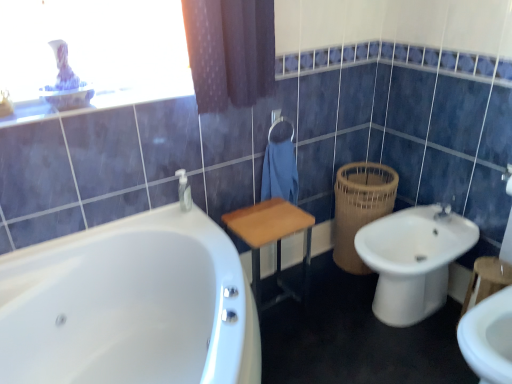
Question: Can you confirm if blue fabric towel at center is shorter than white ceramic bidet at lower right?

Choices:
 (A) yes
 (B) no

Answer: (A)

Question: Is blue fabric towel at center further to camera compared to white ceramic bidet at lower right?

Choices:
 (A) no
 (B) yes

Answer: (B)

Question: Is blue fabric towel at center placed right next to white ceramic bidet at lower right?

Choices:
 (A) yes
 (B) no

Answer: (B)

Question: Can we say blue fabric towel at center lies outside white ceramic bidet at lower right?

Choices:
 (A) no
 (B) yes

Answer: (B)

Question: Considering the relative sizes of blue fabric towel at center and white ceramic bidet at lower right in the image provided, is blue fabric towel at center bigger than white ceramic bidet at lower right?

Choices:
 (A) no
 (B) yes

Answer: (A)

Question: In terms of height, does woven brown basket at right look taller or shorter compared to wooden table at center?

Choices:
 (A) short
 (B) tall

Answer: (B)

Question: Is woven brown basket at right situated inside wooden table at center or outside?

Choices:
 (A) inside
 (B) outside

Answer: (B)

Question: In terms of width, does woven brown basket at right look wider or thinner when compared to wooden table at center?

Choices:
 (A) thin
 (B) wide

Answer: (B)

Question: From the image's perspective, is woven brown basket at right located above or below wooden table at center?

Choices:
 (A) above
 (B) below

Answer: (A)

Question: Considering their positions, is white ceramic bidet at lower right located in front of or behind white glossy bathtub at lower left?

Choices:
 (A) front
 (B) behind

Answer: (B)

Question: Would you say white ceramic bidet at lower right is to the left or to the right of white glossy bathtub at lower left in the picture?

Choices:
 (A) left
 (B) right

Answer: (B)

Question: Considering the positions of white ceramic bidet at lower right and white glossy bathtub at lower left in the image, is white ceramic bidet at lower right taller or shorter than white glossy bathtub at lower left?

Choices:
 (A) tall
 (B) short

Answer: (B)

Question: Does point (393, 297) appear closer or farther from the camera than point (66, 347)?

Choices:
 (A) farther
 (B) closer

Answer: (A)

Question: From the image's perspective, is woven brown basket at right positioned above or below white glossy bathtub at lower left?

Choices:
 (A) below
 (B) above

Answer: (B)

Question: Does point (364, 196) appear closer or farther from the camera than point (219, 246)?

Choices:
 (A) closer
 (B) farther

Answer: (B)